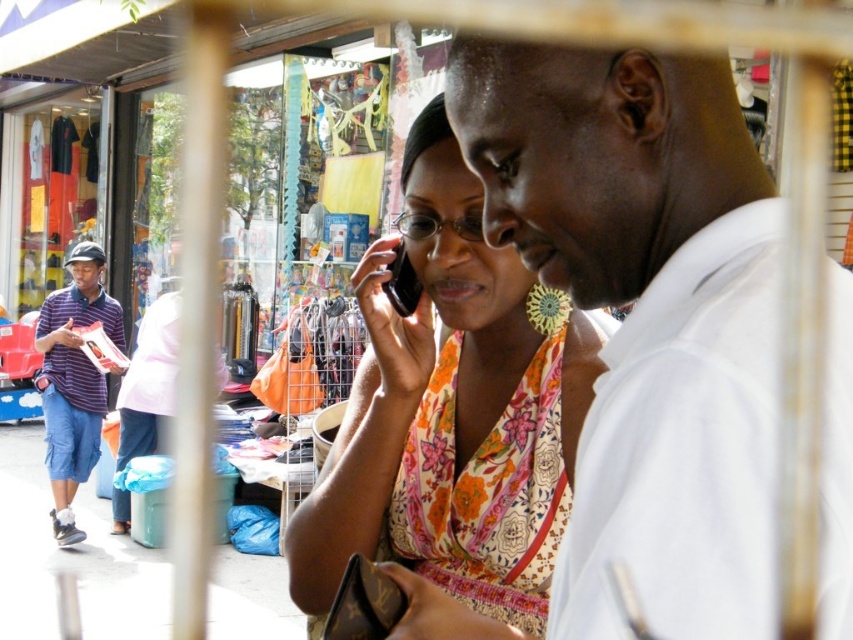
You are a delivery person who needs to deliver a package to the person wearing the white cotton shirt at center. The GPS coordinates of the shirt are at point 0.494, 0.757. If the delivery area is a circle with a radius of 0.3 centered at the origin, will the shirt be inside the delivery area?

The white cotton shirt at center is located at coordinates (645, 316). The distance from the origin is sqrt0.494 squared plus 0.757 squared equals approximately 0.899. Since 0.899 is greater than the radius of 0.3, the shirt is outside the delivery area.

You are a delivery robot with a 36 inch wide package. You need to pass between the white cotton shirt at center and the black plastic phone at center. Can you fit through the space between them?

The white cotton shirt at center and black plastic phone at center are 35.99 inches apart. Since your package is 36 inches wide, it is slightly wider than the available space, so you cannot fit through the space between them.

Looking at this image, you are standing in the market scene described. There is a specific point marked at coordinates point [556,577]. If you want to reach this point without moving your feet, can you touch it with your outstretched hand?

The point [556,577] is 3.45 feet from the viewer. Since the average person can reach about 2.5 to 3 feet with their arm, you might just barely be able to touch it with your outstretched hand, but it could be a bit challenging.